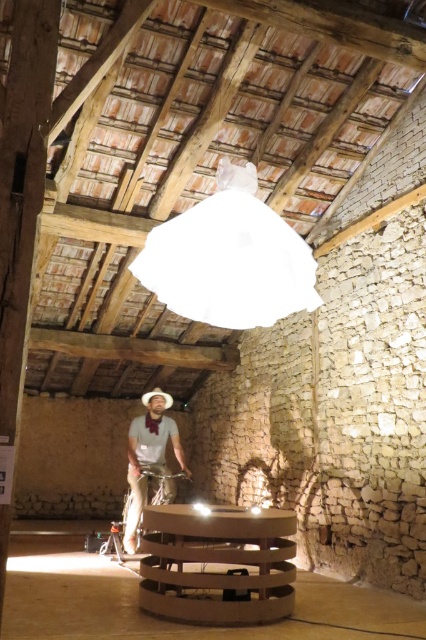
You are standing in the rustic interior space and see both the light brown leather jacket at center and the brown felt cowboy hat at center. Which object is nearer to you?

The light brown leather jacket at center is closer to the viewer than the brown felt cowboy hat at center.

You are standing in the rustic interior space described. You need to place a new decorative item on the white matte lampshade at upper center. What are the coordinates where you should position it?

The coordinates for the white matte lampshade at upper center are 0.405 in the x direction and 0.538 in the y direction.

You are planning to place a new decorative item on the white matte lampshade at upper center and the light brown leather jacket at center. Given their sizes, which object would allow you to place a larger decorative item?

The light brown leather jacket at center is larger than the white matte lampshade at upper center, so it can accommodate a larger decorative item.